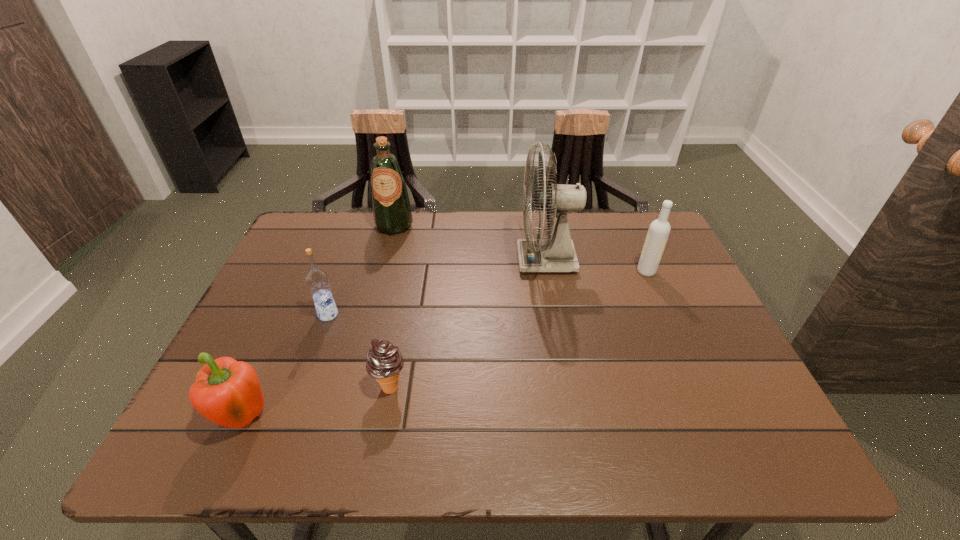
Where is `fan`? This screenshot has width=960, height=540. fan is located at coordinates (556, 253).

Identify the location of the tallest object. This screenshot has width=960, height=540. (556, 253).

In order to click on the second tallest object in this screenshot , I will do `click(392, 215)`.

Identify the location of the rightmost object. (659, 230).

You are a GUI agent. You are given a task and a screenshot of the screen. Output one action in this format:
    pyautogui.click(x=<x>, y=<y>)
    Task: Click on the farther vodka
    This screenshot has width=960, height=540.
    Given the screenshot: What is the action you would take?
    tap(659, 230)

Where is `the fourth farthest object`? The image size is (960, 540). the fourth farthest object is located at coordinates (317, 280).

The height and width of the screenshot is (540, 960). In order to click on the nearer vodka in this screenshot , I will do pos(317,280).

Find the location of a particular element. This screenshot has width=960, height=540. the leftmost object is located at coordinates (227, 392).

Where is `icecream`? Image resolution: width=960 pixels, height=540 pixels. icecream is located at coordinates point(384,362).

At what (x,y) coordinates should I click in order to perform the action: click on free location located on the front-facing side of the fan. Please return your answer as a coordinate pair (x, y). This screenshot has height=540, width=960. Looking at the image, I should click on click(x=444, y=260).